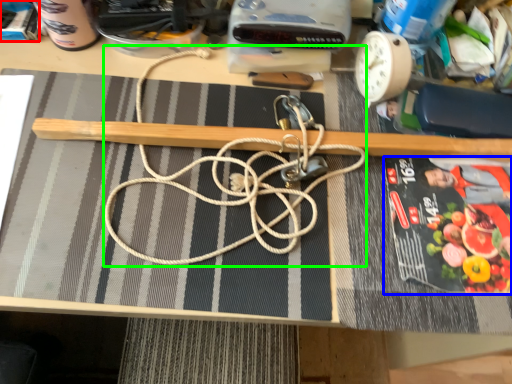
Question: Considering the real-world distances, which object is closest to paperback book (highlighted by a red box)? paperback book (highlighted by a blue box) or string (highlighted by a green box).

Choices:
 (A) paperback book
 (B) string

Answer: (B)